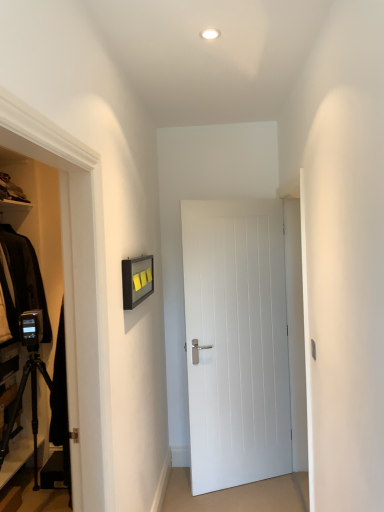
Identify the location of white glossy light fixture at upper center. The height and width of the screenshot is (512, 384). (210, 34).

Consider the image. What is the approximate width of white glossy light fixture at upper center?

white glossy light fixture at upper center is 3.62 inches in width.

Where is `black matte tripod at lower left`? The image size is (384, 512). black matte tripod at lower left is located at coordinates (36, 244).

Does black matte tripod at lower left have a lesser width compared to white smooth door at center?

No.

From the image's perspective, would you say black matte tripod at lower left is shown under white smooth door at center?

Actually, black matte tripod at lower left appears above white smooth door at center in the image.

Between black matte tripod at lower left and white smooth door at center, which one is positioned in front?

Positioned in front is black matte tripod at lower left.

Which is more to the right, black matte tripod at lower left or white smooth door at center?

white smooth door at center.

From a real-world perspective, is white glossy light fixture at upper center physically located above or below black matte tripod at lower left?

In terms of real-world spatial position, white glossy light fixture at upper center is above black matte tripod at lower left.

Between point (212, 32) and point (28, 250), which one is positioned in front?

The point (212, 32) is closer.

Can you confirm if white glossy light fixture at upper center is shorter than black matte tripod at lower left?

Yes, white glossy light fixture at upper center is shorter than black matte tripod at lower left.

Between white smooth door at center and white glossy light fixture at upper center, which one appears on the right side from the viewer's perspective?

white smooth door at center is more to the right.

From a real-world perspective, is white smooth door at center located higher than white glossy light fixture at upper center?

No.

Considering the relative sizes of white smooth door at center and white glossy light fixture at upper center in the image provided, is white smooth door at center wider than white glossy light fixture at upper center?

Yes, white smooth door at center is wider than white glossy light fixture at upper center.

Is white smooth door at center in front of white glossy light fixture at upper center?

No, the depth of white smooth door at center is greater than that of white glossy light fixture at upper center.

From the image's perspective, between white glossy light fixture at upper center and white smooth door at center, who is located below?

white smooth door at center, from the image's perspective.

Consider the image. Which is correct: white glossy light fixture at upper center is inside white smooth door at center, or outside of it?

white glossy light fixture at upper center is not inside white smooth door at center, it's outside.

Does white glossy light fixture at upper center come behind white smooth door at center?

No, it is not.

Considering the points (195, 314) and (7, 208), which point is behind, point (195, 314) or point (7, 208)?

The point (7, 208) is farther from the camera.

Is black matte tripod at lower left at the back of white smooth door at center?

No.

Where is `lighting on the right of black matte tripod at lower left`? The height and width of the screenshot is (512, 384). lighting on the right of black matte tripod at lower left is located at coordinates (210, 34).

Is black matte tripod at lower left located outside white glossy light fixture at upper center?

Indeed, black matte tripod at lower left is completely outside white glossy light fixture at upper center.

Considering the relative positions of black matte tripod at lower left and white glossy light fixture at upper center in the image provided, is black matte tripod at lower left to the left of white glossy light fixture at upper center from the viewer's perspective?

Yes.

Is black matte tripod at lower left facing away from white glossy light fixture at upper center?

No, black matte tripod at lower left is not facing the opposite direction of white glossy light fixture at upper center.

This screenshot has height=512, width=384. What are the coordinates of `dresser above the white smooth door at center (from a real-world perspective)` in the screenshot? It's located at (36, 244).

This screenshot has width=384, height=512. In order to click on dresser below the white glossy light fixture at upper center (from the image's perspective) in this screenshot , I will do `click(36, 244)`.

Considering their positions, is black matte tripod at lower left positioned closer to white smooth door at center than white glossy light fixture at upper center?

black matte tripod at lower left lies closer to white smooth door at center than the other object.

From the picture: From the image, which object appears to be nearer to white glossy light fixture at upper center, white smooth door at center or black matte tripod at lower left?

white smooth door at center.

When comparing their distances from white smooth door at center, does white glossy light fixture at upper center or black matte tripod at lower left seem further?

white glossy light fixture at upper center.

Estimate the real-world distances between objects in this image. Which object is closer to black matte tripod at lower left, white glossy light fixture at upper center or white smooth door at center?

white smooth door at center.

Based on their spatial positions, is black matte tripod at lower left or white smooth door at center further from white glossy light fixture at upper center?

black matte tripod at lower left is positioned further to the anchor white glossy light fixture at upper center.

Considering their positions, is white smooth door at center positioned closer to black matte tripod at lower left than white glossy light fixture at upper center?

white smooth door at center is positioned closer to the anchor black matte tripod at lower left.

This screenshot has height=512, width=384. Find the location of `lighting situated between black matte tripod at lower left and white smooth door at center from left to right`. lighting situated between black matte tripod at lower left and white smooth door at center from left to right is located at coordinates (210, 34).